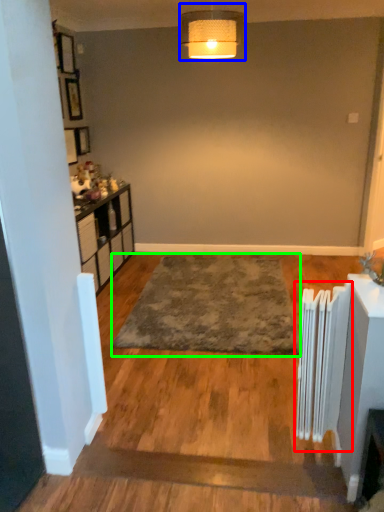
Question: Considering the real-world distances, which object is farthest from radiator (highlighted by a red box)? lamp (highlighted by a blue box) or mat (highlighted by a green box)?

Choices:
 (A) lamp
 (B) mat

Answer: (A)